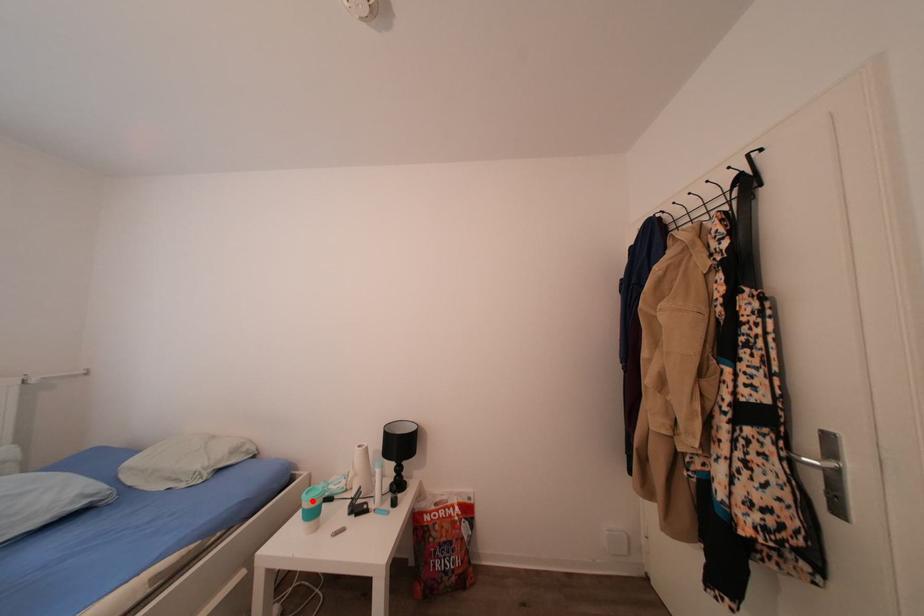
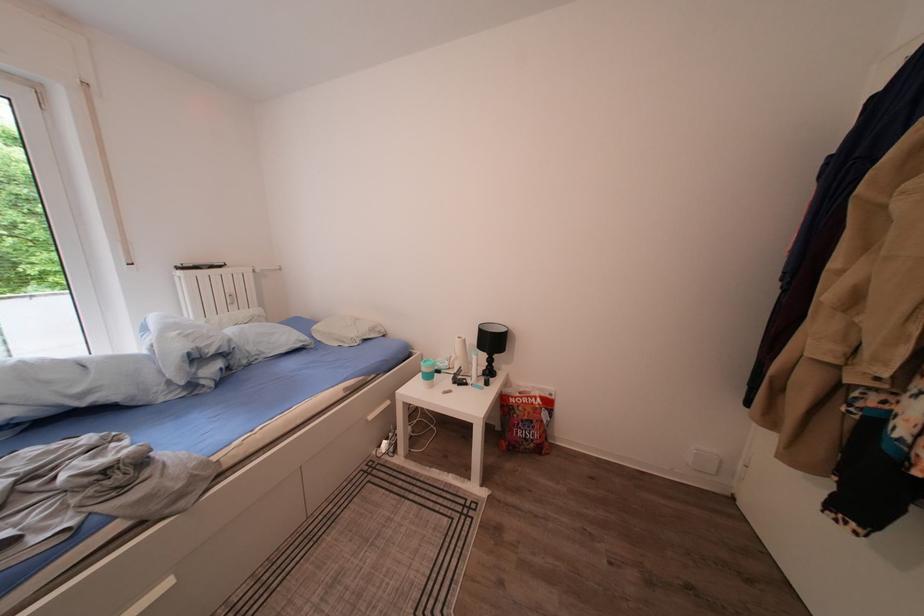
Where in the second image is the point corresponding to the highlighted location from the first image?

(431, 369)